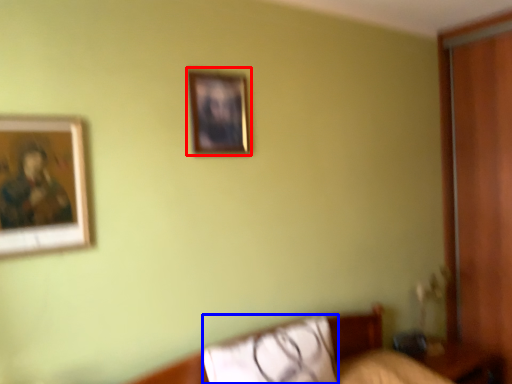
Question: Which point is further to the camera, picture frame (highlighted by a red box) or pillow (highlighted by a blue box)?

Choices:
 (A) picture frame
 (B) pillow

Answer: (A)